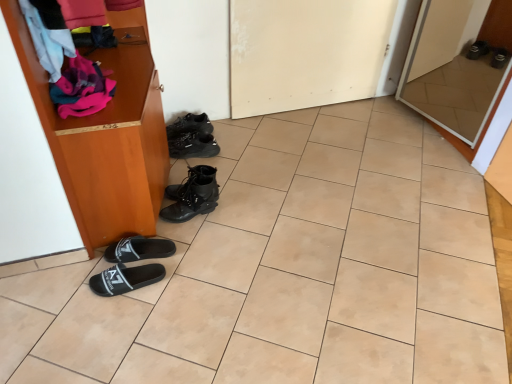
Question: Considering the relative sizes of black leather sneakers at center, which ranks as the 1th footwear in top-to-bottom order, and beige tile at center in the image provided, is black leather sneakers at center, which ranks as the 1th footwear in top-to-bottom order, thinner than beige tile at center?

Choices:
 (A) no
 (B) yes

Answer: (B)

Question: From a real-world perspective, is black leather sneakers at center, which appears as the fifth footwear when viewed from the front, located higher than beige tile at center?

Choices:
 (A) yes
 (B) no

Answer: (A)

Question: Would you say beige tile at center is part of black leather sneakers at center, which ranks as the 1th footwear in top-to-bottom order,'s contents?

Choices:
 (A) yes
 (B) no

Answer: (B)

Question: From the image's perspective, is black leather sneakers at center, which ranks as the 1th footwear in top-to-bottom order, below beige tile at center?

Choices:
 (A) no
 (B) yes

Answer: (A)

Question: Is black leather sneakers at center, which is the 1th footwear from back to front, looking in the opposite direction of beige tile at center?

Choices:
 (A) yes
 (B) no

Answer: (B)

Question: Relative to white matte door at center, which is the 1th door from left to right, is black fabric slipper at lower left, which is the second footwear from bottom to top, in front or behind?

Choices:
 (A) behind
 (B) front

Answer: (B)

Question: From a real-world perspective, is black fabric slipper at lower left, which ranks as the fourth footwear in back-to-front order, physically located above or below white matte door at center, which is the 1th door from left to right?

Choices:
 (A) above
 (B) below

Answer: (B)

Question: From the image's perspective, relative to white matte door at center, which is the 1th door from left to right, is black fabric slipper at lower left, the 4th footwear from the top, above or below?

Choices:
 (A) below
 (B) above

Answer: (A)

Question: Based on their sizes in the image, would you say black fabric slipper at lower left, the 2th footwear when ordered from front to back, is bigger or smaller than white matte door at center, the second door positioned from the right?

Choices:
 (A) big
 (B) small

Answer: (B)

Question: Do you think black fabric slipper at lower left, which is the 5th footwear in top-to-bottom order, is within black leather boots at center, which is counted as the third footwear, starting from the top, or outside of it?

Choices:
 (A) inside
 (B) outside

Answer: (B)

Question: Based on their sizes in the image, would you say black fabric slipper at lower left, which is the 5th footwear in top-to-bottom order, is bigger or smaller than black leather boots at center, which appears as the 3th footwear when viewed from the back?

Choices:
 (A) big
 (B) small

Answer: (B)

Question: Is black fabric slipper at lower left, the fifth footwear in the back-to-front sequence, taller or shorter than black leather boots at center, which appears as the 3th footwear when viewed from the back?

Choices:
 (A) short
 (B) tall

Answer: (A)

Question: Is black fabric slipper at lower left, which is the 5th footwear in top-to-bottom order, to the left or to the right of black leather boots at center, which is counted as the third footwear, starting from the top, in the image?

Choices:
 (A) left
 (B) right

Answer: (A)

Question: In the image, is black leather sneakers at center, positioned as the 5th footwear in bottom-to-top order, positioned in front of or behind white glossy door at upper right, the 1th door in the right-to-left sequence?

Choices:
 (A) behind
 (B) front

Answer: (A)

Question: Based on their sizes in the image, would you say black leather sneakers at center, which ranks as the 1th footwear in top-to-bottom order, is bigger or smaller than white glossy door at upper right, the 1th door in the right-to-left sequence?

Choices:
 (A) small
 (B) big

Answer: (A)